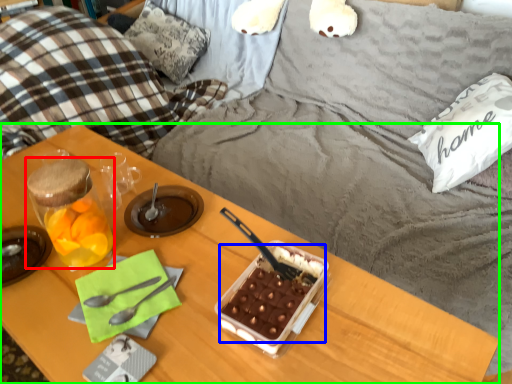
Question: Which object is positioned closest to snack (highlighted by a red box)? Select from snack (highlighted by a blue box) and desk (highlighted by a green box).

Choices:
 (A) snack
 (B) desk

Answer: (B)